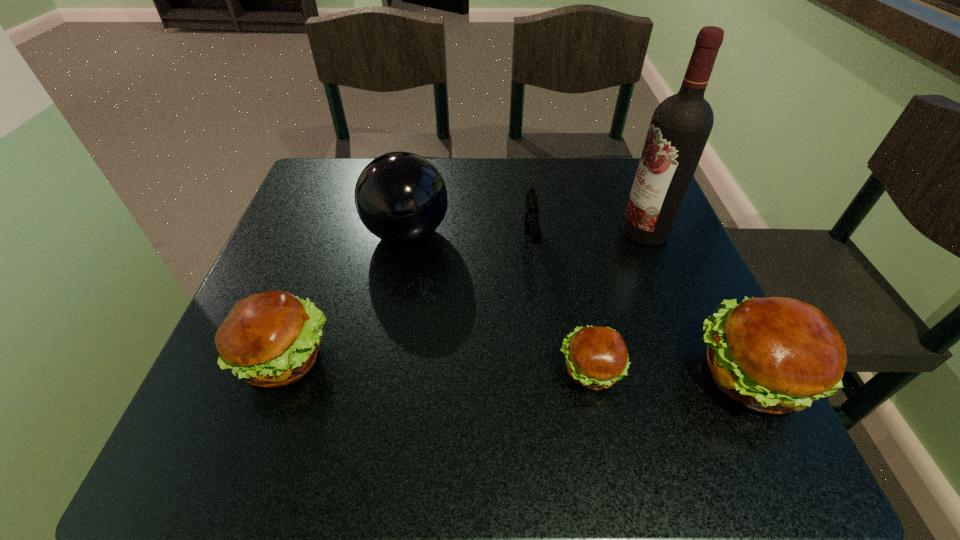
Identify the location of vacant area between the rightmost hamburger and the second hamburger from left to right. The height and width of the screenshot is (540, 960). (669, 374).

This screenshot has width=960, height=540. Find the location of `free space between the third object from left to right and the wine bottle`. free space between the third object from left to right and the wine bottle is located at coordinates (588, 237).

This screenshot has height=540, width=960. I want to click on free spot between the fifth shortest object and the fourth object from right to left, so click(468, 238).

What are the coordinates of `vacant region between the fourth object from left to right and the second tallest object` in the screenshot? It's located at (498, 302).

Where is `vacant region between the rightmost hamburger and the leftmost hamburger`? The image size is (960, 540). vacant region between the rightmost hamburger and the leftmost hamburger is located at coordinates (516, 367).

Locate an element on the screen. blank region between the wine bottle and the rightmost hamburger is located at coordinates (697, 304).

Where is `vacant space that's between the rightmost hamburger and the tallest object`? vacant space that's between the rightmost hamburger and the tallest object is located at coordinates (697, 304).

Find the location of a particular element. The image size is (960, 540). unoccupied position between the rightmost hamburger and the fourth tallest object is located at coordinates (516, 367).

I want to click on vacant region between the rightmost hamburger and the leftmost hamburger, so click(516, 367).

Locate an element on the screen. The width and height of the screenshot is (960, 540). the closest object to the wine bottle is located at coordinates (531, 220).